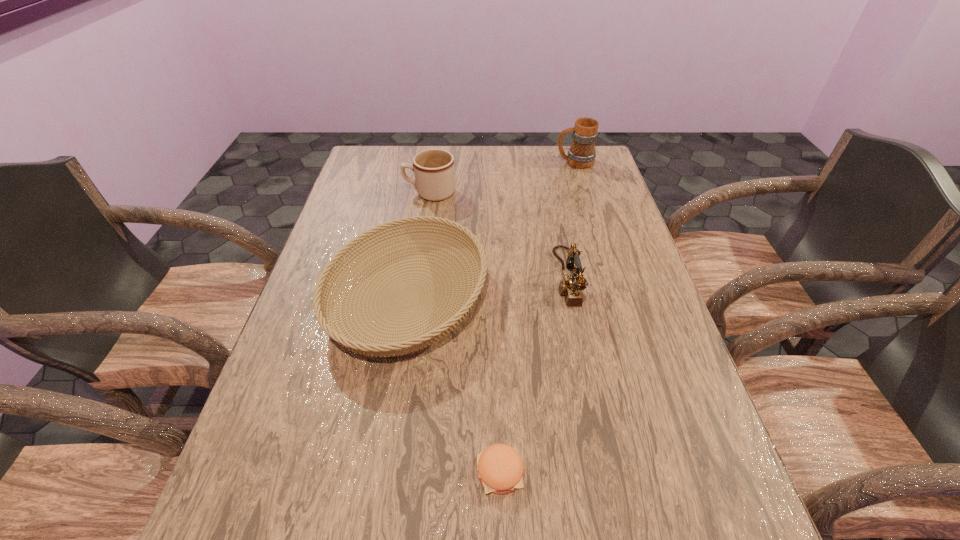
Locate an element on the screen. The image size is (960, 540). vacant area situated 0.370m on the side of the farthest object with the handle is located at coordinates (450, 162).

The height and width of the screenshot is (540, 960). I want to click on blank space located on the side of the shorter mug with the handle, so click(376, 193).

Locate an element on the screen. vacant space located on the side of the shorter mug with the handle is located at coordinates point(348,193).

In order to click on free spot located on the side of the shorter mug with the handle in this screenshot , I will do `click(345, 193)`.

Identify the location of vacant space located 0.130m on the front-facing side of the second object from right to left. (505, 278).

In order to click on free space located on the front-facing side of the second object from right to left in this screenshot , I will do `click(528, 278)`.

This screenshot has height=540, width=960. In order to click on vacant space situated 0.160m on the front-facing side of the second object from right to left in this screenshot , I will do `click(492, 278)`.

Locate an element on the screen. Image resolution: width=960 pixels, height=540 pixels. vacant space located on the back of the basket is located at coordinates (420, 224).

Identify the location of free spot located on the right of the shortest object. (637, 472).

Locate an element on the screen. The image size is (960, 540). object that is at the far edge is located at coordinates (581, 154).